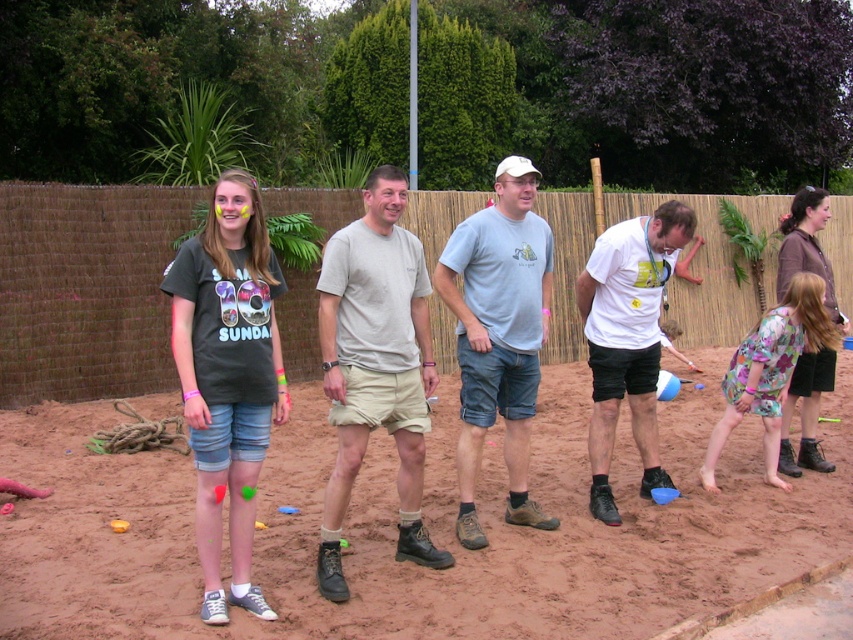
Between light gray cotton t-shirt at center and white matte t-shirt at center, which one has more height?

With more height is light gray cotton t-shirt at center.

Does light gray cotton t-shirt at center have a lesser height compared to white matte t-shirt at center?

No.

The height and width of the screenshot is (640, 853). What do you see at coordinates (375, 365) in the screenshot?
I see `light gray cotton t-shirt at center` at bounding box center [375, 365].

Where is `light gray cotton t-shirt at center`? Image resolution: width=853 pixels, height=640 pixels. light gray cotton t-shirt at center is located at coordinates (375, 365).

How much distance is there between dark gray t-shirt at left and white matte t-shirt at center?

dark gray t-shirt at left is 21.31 inches from white matte t-shirt at center.

Which is more to the left, dark gray t-shirt at left or white matte t-shirt at center?

dark gray t-shirt at left is more to the left.

Find the location of a particular element. This screenshot has height=640, width=853. dark gray t-shirt at left is located at coordinates (375, 387).

Image resolution: width=853 pixels, height=640 pixels. Describe the element at coordinates (498, 336) in the screenshot. I see `light gray t-shirt at center` at that location.

Which is above, light gray t-shirt at center or white matte t-shirt at center?

light gray t-shirt at center is higher up.

Which is behind, point (471, 404) or point (595, 506)?

The point (595, 506) is more distant.

Locate an element on the screen. The height and width of the screenshot is (640, 853). light gray t-shirt at center is located at coordinates tap(498, 336).